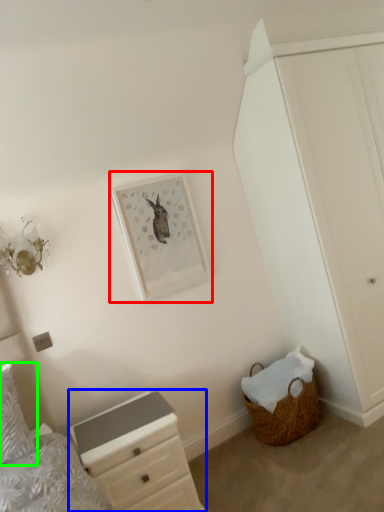
Question: Which object is the farthest from picture frame (highlighted by a red box)? Choose among these: chest of drawers (highlighted by a blue box) or pillow (highlighted by a green box).

Choices:
 (A) chest of drawers
 (B) pillow

Answer: (B)